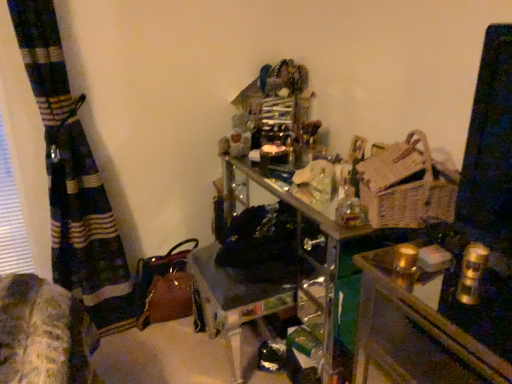
What do you see at coordinates (405, 186) in the screenshot? The height and width of the screenshot is (384, 512). I see `woven wicker basket at right` at bounding box center [405, 186].

Find the location of a particular element. woven wicker basket at right is located at coordinates (405, 186).

What is the approximate height of metallic gold candlesticks at center?

metallic gold candlesticks at center is 25.68 inches in height.

What do you see at coordinates (414, 334) in the screenshot? I see `metallic gold candlesticks at center` at bounding box center [414, 334].

Image resolution: width=512 pixels, height=384 pixels. I want to click on metallic gold candlesticks at center, so click(414, 334).

At what (x,y) coordinates should I click in order to perform the action: click on woven wicker basket at right. Please return your answer as a coordinate pair (x, y). Looking at the image, I should click on (405, 186).

Does metallic gold candlesticks at center appear on the left side of woven wicker basket at right?

No.

In the image, is metallic gold candlesticks at center positioned in front of or behind woven wicker basket at right?

Visually, metallic gold candlesticks at center is located in front of woven wicker basket at right.

Which is closer, [421,243] or [366,170]?

Point [421,243]

From the image's perspective, is metallic gold candlesticks at center on woven wicker basket at right?

Actually, metallic gold candlesticks at center appears below woven wicker basket at right in the image.

From a real-world perspective, is metallic gold candlesticks at center under woven wicker basket at right?

Yes, from a real-world perspective, metallic gold candlesticks at center is under woven wicker basket at right.

Can you confirm if metallic gold candlesticks at center is thinner than woven wicker basket at right?

In fact, metallic gold candlesticks at center might be wider than woven wicker basket at right.

Can you confirm if metallic gold candlesticks at center is taller than woven wicker basket at right?

Indeed, metallic gold candlesticks at center has a greater height compared to woven wicker basket at right.

Does metallic gold candlesticks at center have a smaller size compared to woven wicker basket at right?

No, metallic gold candlesticks at center is not smaller than woven wicker basket at right.

Looking at this image, is metallic gold candlesticks at center inside or outside of woven wicker basket at right?

metallic gold candlesticks at center is not inside woven wicker basket at right, it's outside.

Are metallic gold candlesticks at center and woven wicker basket at right located far from each other?

They are positioned close to each other.

Is metallic gold candlesticks at center positioned with its back to woven wicker basket at right?

No, metallic gold candlesticks at center is not facing away from woven wicker basket at right.

What's the angular difference between metallic gold candlesticks at center and woven wicker basket at right's facing directions?

They differ by 23.2 degrees in their facing directions.

Locate an element on the screen. The width and height of the screenshot is (512, 384). basket that appears on the left of metallic gold candlesticks at center is located at coordinates tap(405, 186).

In the image, is woven wicker basket at right on the left side or the right side of metallic gold candlesticks at center?

Based on their positions, woven wicker basket at right is located to the left of metallic gold candlesticks at center.

Which object is further away from the camera, woven wicker basket at right or metallic gold candlesticks at center?

Positioned behind is woven wicker basket at right.

Consider the image. Which is less distant, [394,207] or [389,342]?

The point [389,342] is more forward.

From the image's perspective, which is below, woven wicker basket at right or metallic gold candlesticks at center?

metallic gold candlesticks at center is shown below in the image.

From a real-world perspective, does woven wicker basket at right sit lower than metallic gold candlesticks at center?

No, from a real-world perspective, woven wicker basket at right is not beneath metallic gold candlesticks at center.

Does woven wicker basket at right have a lesser width compared to metallic gold candlesticks at center?

Indeed, woven wicker basket at right has a lesser width compared to metallic gold candlesticks at center.

Considering the relative sizes of woven wicker basket at right and metallic gold candlesticks at center in the image provided, is woven wicker basket at right taller than metallic gold candlesticks at center?

In fact, woven wicker basket at right may be shorter than metallic gold candlesticks at center.

Considering the relative sizes of woven wicker basket at right and metallic gold candlesticks at center in the image provided, is woven wicker basket at right smaller than metallic gold candlesticks at center?

Yes.

Is metallic gold candlesticks at center inside woven wicker basket at right?

That's incorrect, metallic gold candlesticks at center is not inside woven wicker basket at right.

Would you say woven wicker basket at right is a long distance from metallic gold candlesticks at center?

No, there isn't a large distance between woven wicker basket at right and metallic gold candlesticks at center.

Is woven wicker basket at right facing away from metallic gold candlesticks at center?

No.

The width and height of the screenshot is (512, 384). In order to click on table that appears below the woven wicker basket at right (from the image's perspective) in this screenshot , I will do `click(414, 334)`.

I want to click on table located on the right of woven wicker basket at right, so click(414, 334).

Locate an element on the screen. The height and width of the screenshot is (384, 512). basket located behind the metallic gold candlesticks at center is located at coordinates (405, 186).